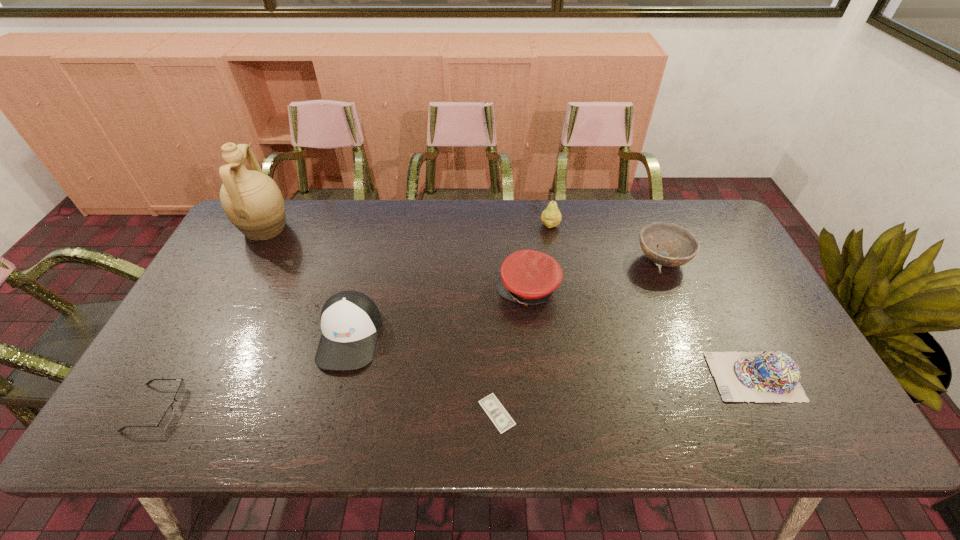
In order to click on vacant space located on the front-facing side of the second shortest object in this screenshot , I will do `click(235, 408)`.

The image size is (960, 540). I want to click on free region located 0.340m on the right of the shortest object, so click(x=663, y=413).

Find the location of a particular element. pitcher present at the far edge is located at coordinates (252, 201).

Locate an element on the screen. pear located at the far edge is located at coordinates (551, 217).

Find the location of a particular element. This screenshot has height=540, width=960. bowl situated at the far edge is located at coordinates (683, 247).

Locate an element on the screen. spectacles at the near edge is located at coordinates (168, 415).

Find the location of `money present at the near edge`. money present at the near edge is located at coordinates (499, 416).

At what (x,y) coordinates should I click in order to perform the action: click on pitcher that is at the left edge. Please return your answer as a coordinate pair (x, y). The image size is (960, 540). Looking at the image, I should click on (252, 201).

Identify the location of spectacles positioned at the left edge. This screenshot has height=540, width=960. (168, 415).

The image size is (960, 540). I want to click on bowl at the right edge, so click(x=683, y=247).